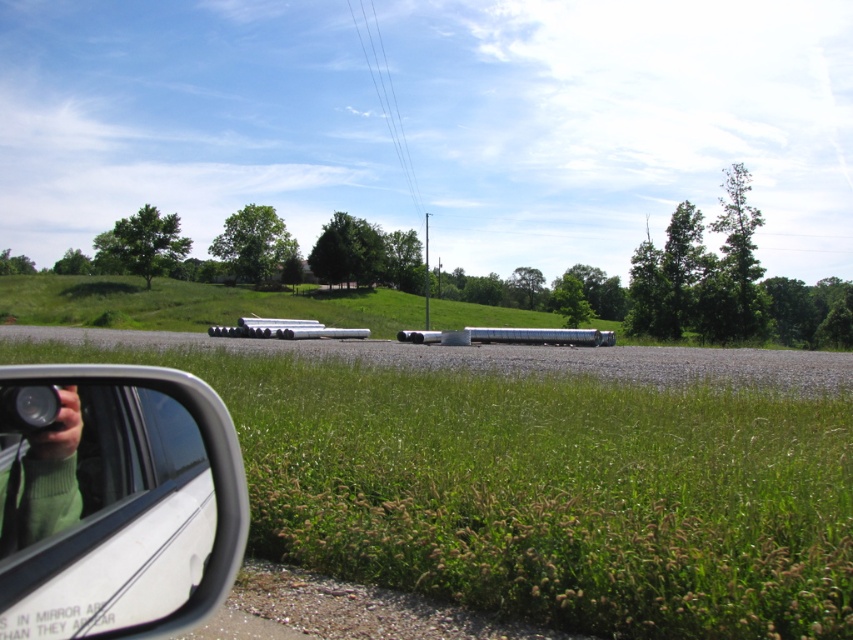
Question: Does white glossy rearview mirror at lower left have a lesser width compared to green sweater at lower left?

Choices:
 (A) yes
 (B) no

Answer: (B)

Question: Which object appears farthest from the camera in this image?

Choices:
 (A) white glossy rearview mirror at lower left
 (B) green sweater at lower left

Answer: (A)

Question: Which point is closer to the camera?

Choices:
 (A) (32, 570)
 (B) (55, 428)

Answer: (A)

Question: Is white glossy rearview mirror at lower left below green sweater at lower left?

Choices:
 (A) no
 (B) yes

Answer: (A)

Question: Is white glossy rearview mirror at lower left positioned behind green sweater at lower left?

Choices:
 (A) no
 (B) yes

Answer: (B)